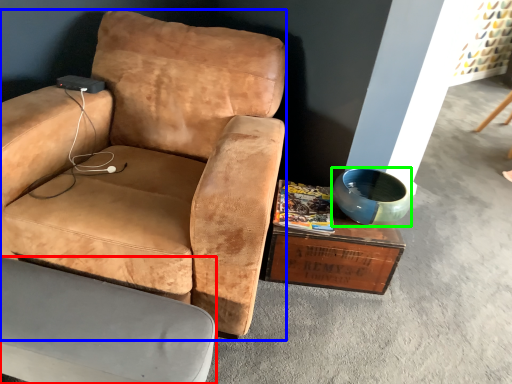
Question: Which object is positioned farthest from chair (highlighted by a red box)? Select from chair (highlighted by a blue box) and bowl (highlighted by a green box).

Choices:
 (A) chair
 (B) bowl

Answer: (B)